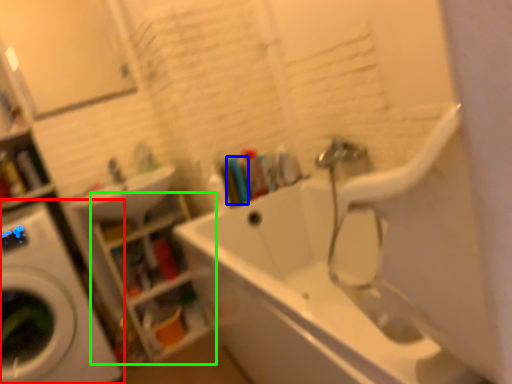
Question: Which object is positioned farthest from washing machine (highlighted by a red box)? Select from toiletry (highlighted by a blue box) and shelf (highlighted by a green box).

Choices:
 (A) toiletry
 (B) shelf

Answer: (A)